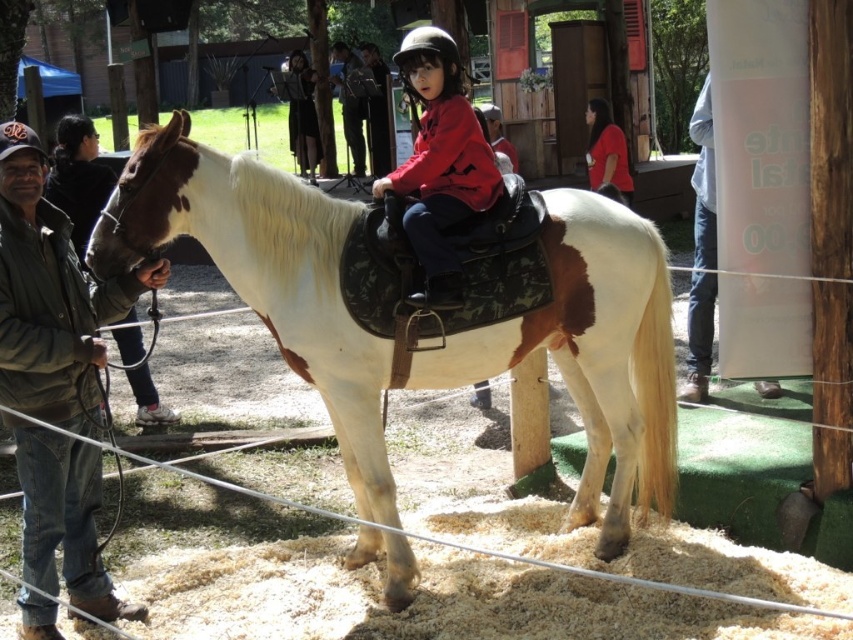
Who is more distant from viewer, (78, 522) or (126, 372)?

Point (126, 372)

Is point (39, 547) closer to camera compared to point (73, 182)?

Yes, point (39, 547) is closer to viewer.

Identify the location of brown leather jacket at left. This screenshot has width=853, height=640. (51, 298).

Is the position of white leather horse at center less distant than that of brown leather jacket at left?

No, it is behind brown leather jacket at left.

Is point (648, 392) more distant than point (54, 529)?

Yes.

The height and width of the screenshot is (640, 853). I want to click on white leather horse at center, so click(263, 275).

Does brown leather jacket at left have a larger size compared to red matte shirt at center?

Correct, brown leather jacket at left is larger in size than red matte shirt at center.

This screenshot has height=640, width=853. I want to click on brown leather jacket at left, so click(x=51, y=298).

Describe the element at coordinates (51, 298) in the screenshot. The image size is (853, 640). I see `brown leather jacket at left` at that location.

I want to click on brown leather jacket at left, so click(51, 298).